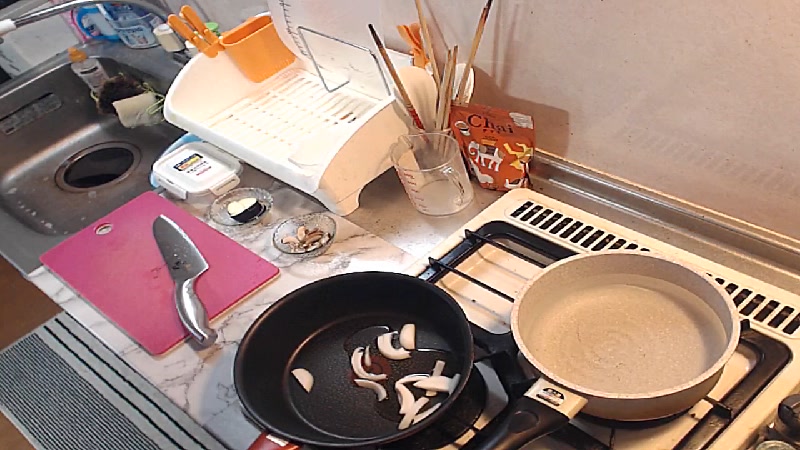
This screenshot has height=450, width=800. In order to click on stove in this screenshot , I will do `click(702, 434)`.